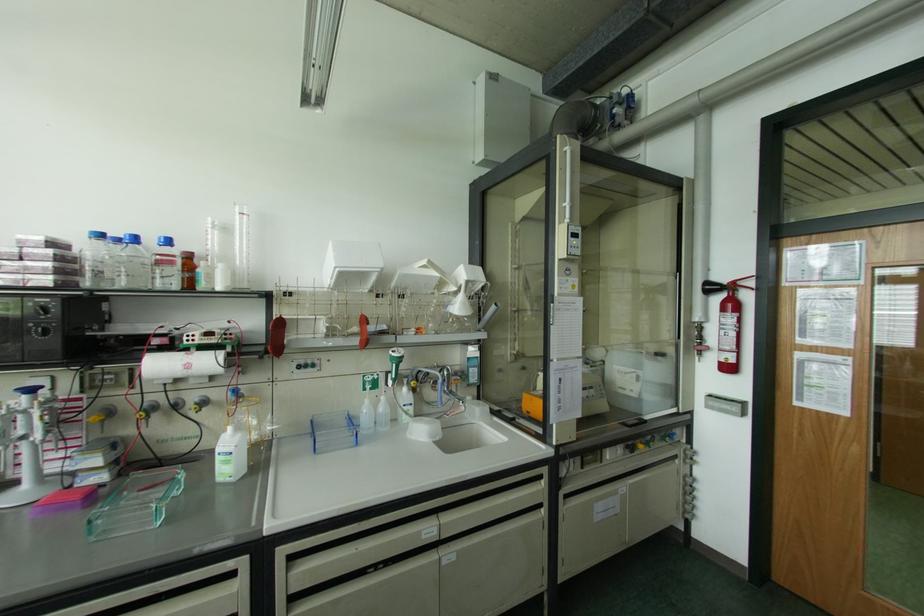
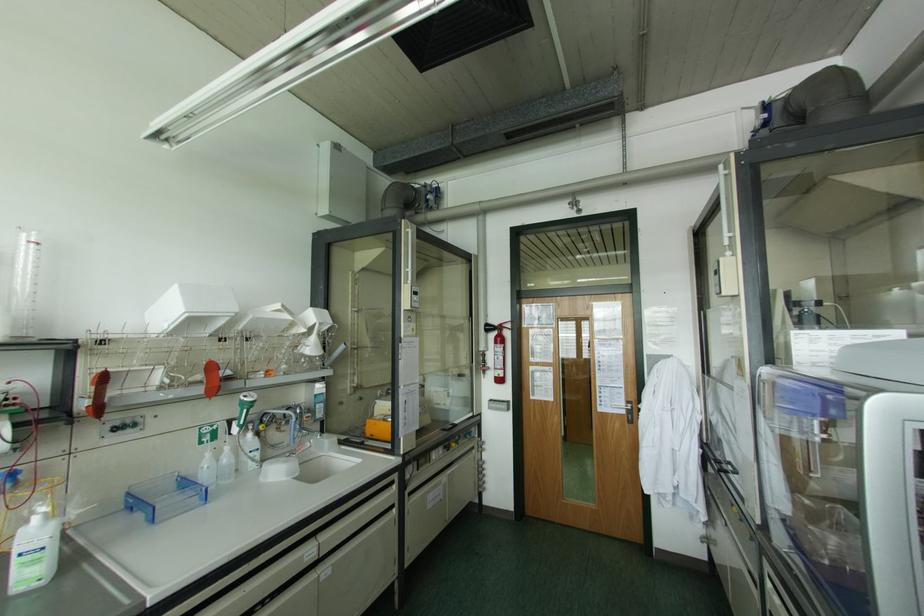
Locate, in the second image, the point that corresponds to the point at 367,400 in the first image.

(208, 454)